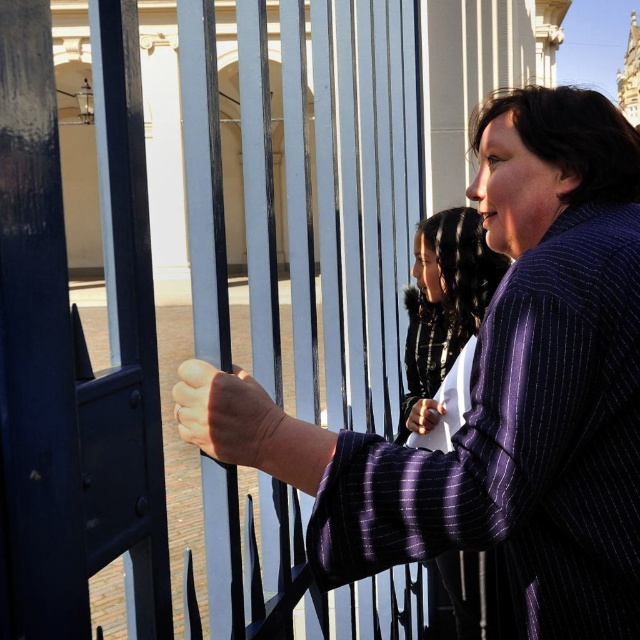
You are a fashion designer observing two people near a fence. You notice the purple pinstripe robe at right and the pinstriped wool coat at center. Which clothing item is positioned more to the east side of the fence?

The purple pinstripe robe at right is positioned more to the east side of the fence because it is to the right of the pinstriped wool coat at center.

You are a fashion designer observing two people near a fence. You notice the purple pinstripe robe at right and the pinstriped wool coat at center. Which clothing item is positioned higher relative to the other?

The purple pinstripe robe at right is located above the pinstriped wool coat at center, so it is positioned higher.

You are standing at the point marked by coordinates point (522,445) in the image. What object are you directly facing?

The point (522,445) corresponds to the purple pinstripe robe at right, so you are directly facing the purple pinstripe robe at right.